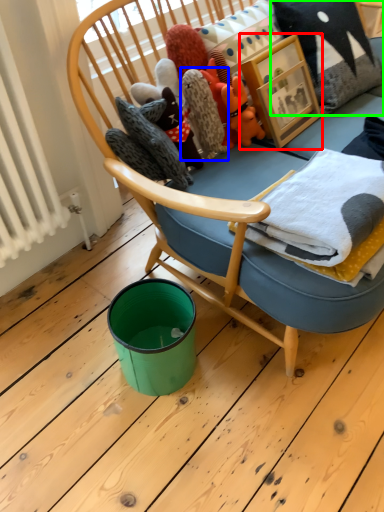
Question: Which object is positioned farthest from picture frame (highlighted by a red box)? Select from cloth (highlighted by a blue box) and pillow (highlighted by a green box).

Choices:
 (A) cloth
 (B) pillow

Answer: (A)